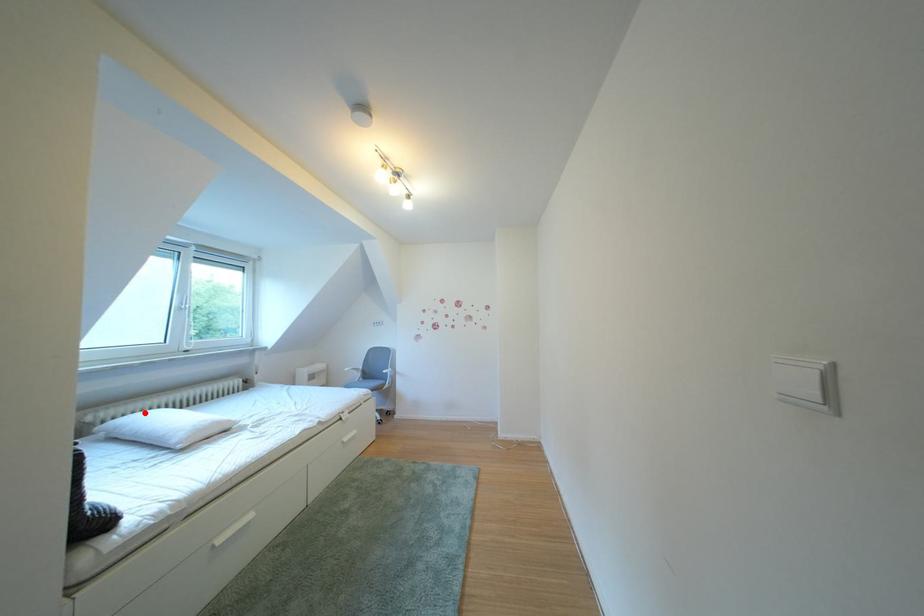
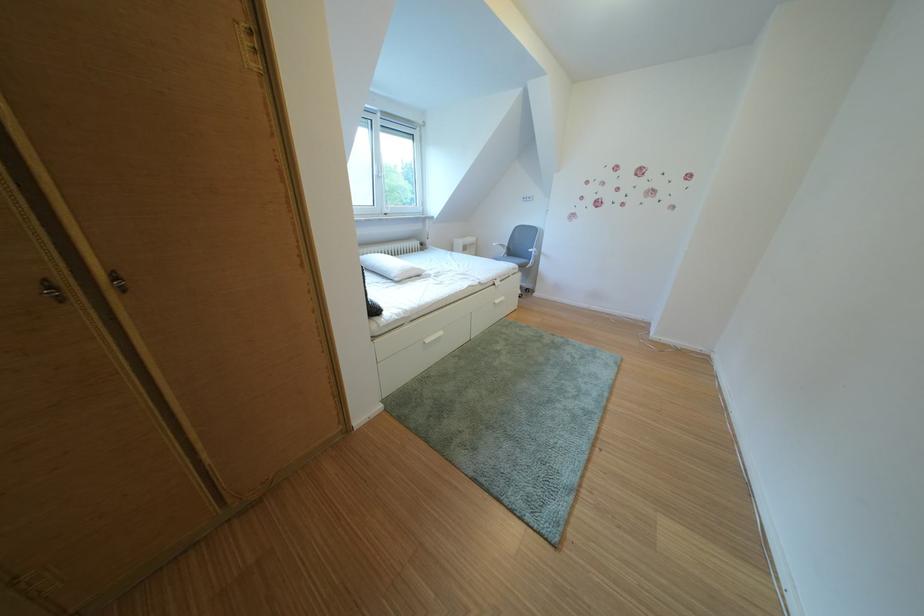
In the second image, find the point that corresponds to the highlighted location in the first image.

(380, 256)